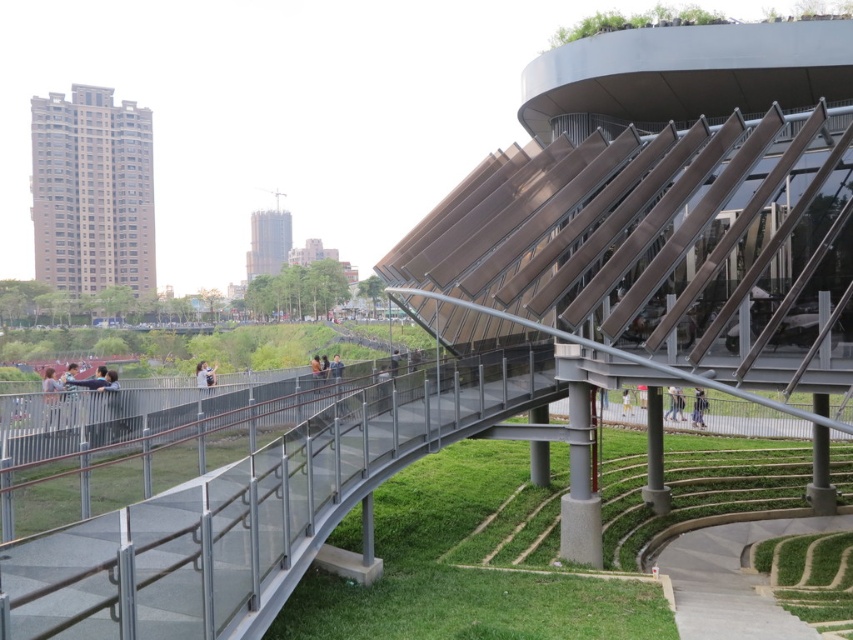
You are a landscape architect evaluating the space between the green grass at lower right and the smooth glass skyscraper at upper center. Which area takes up more ground space?

The smooth glass skyscraper at upper center occupies more ground space than the green grass at lower right.

You are standing at the point marked by the coordinates point (810,577) in the image. What do you see directly below you?

The point (810,577) indicates green grass at lower right, so you are standing above green grass at lower right.

You are a landscape architect evaluating the space between the green grass at lower right and the smooth glass skyscraper at upper center. Which area has a smaller width?

The green grass at lower right is thinner than the smooth glass skyscraper at upper center, so the green grass at lower right has a smaller width.